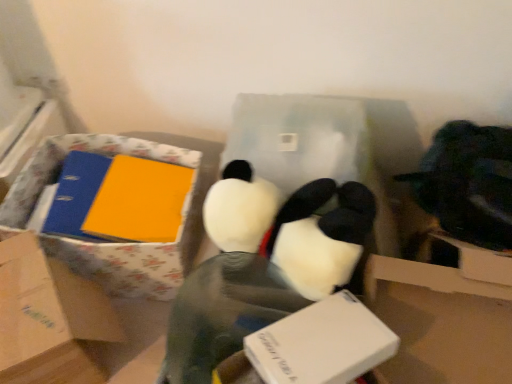
Question: Is white plush toy at center spatially inside floral-patterned cardboard box at left, or outside of it?

Choices:
 (A) outside
 (B) inside

Answer: (A)

Question: Is white plush toy at center bigger or smaller than floral-patterned cardboard box at left?

Choices:
 (A) small
 (B) big

Answer: (A)

Question: Estimate the real-world distances between objects in this image. Which object is closer to the matte yellow book at left?

Choices:
 (A) floral-patterned cardboard box at left
 (B) white plush toy at center
 (C) white fluffy plush at center
 (D) matte cardboard box at left, the 1th box from the left
 (E) blue matte binder at left

Answer: (E)

Question: Which of these objects is positioned farthest from the floral-patterned cardboard box at left?

Choices:
 (A) white plastic box at center, placed as the second box when sorted from left to right
 (B) white plush toy at center
 (C) blue matte binder at left
 (D) white fluffy plush at center
 (E) matte cardboard box at left, the 1th box from the left

Answer: (A)